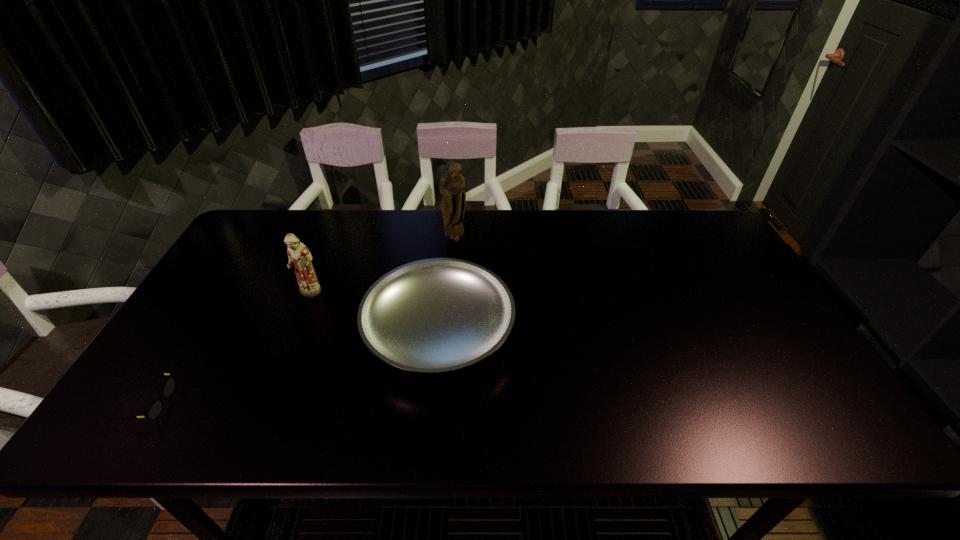
This screenshot has height=540, width=960. I want to click on vacant point that satisfies the following two spatial constraints: 1. on the front-facing side of the bedpan; 2. on the left side of the second object from left to right, so click(295, 328).

Identify the location of vacant space that satisfies the following two spatial constraints: 1. on the front-facing side of the third tallest object; 2. on the right side of the nearer figurine. The height and width of the screenshot is (540, 960). (295, 328).

Locate an element on the screen. The image size is (960, 540). free space that satisfies the following two spatial constraints: 1. on the front-facing side of the left figurine; 2. on the right side of the bedpan is located at coordinates (295, 328).

Identify the location of free location that satisfies the following two spatial constraints: 1. on the front-facing side of the third tallest object; 2. on the right side of the third shortest object. (295, 328).

Where is `vacant space that satisfies the following two spatial constraints: 1. on the front-facing side of the left figurine; 2. on the front-facing side of the spectacles`? vacant space that satisfies the following two spatial constraints: 1. on the front-facing side of the left figurine; 2. on the front-facing side of the spectacles is located at coordinates (264, 403).